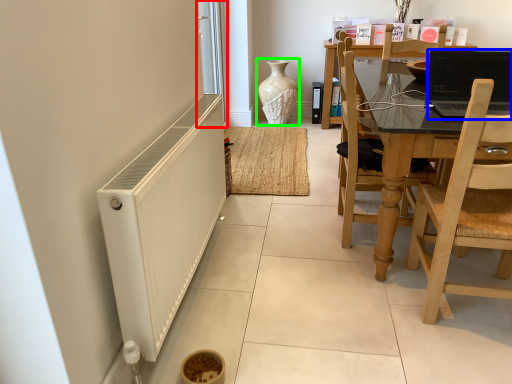
Question: Based on their relative distances, which object is nearer to screen door (highlighted by a red box)? Choose from laptop (highlighted by a blue box) and vase (highlighted by a green box).

Choices:
 (A) laptop
 (B) vase

Answer: (B)